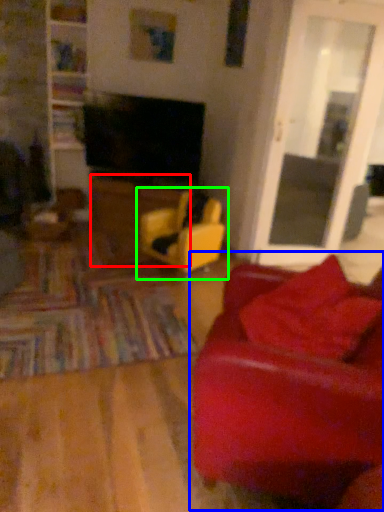
Question: Estimate the real-world distances between objects in this image. Which object is closer to table (highlighted by a red box), studio couch (highlighted by a blue box) or chair (highlighted by a green box)?

Choices:
 (A) studio couch
 (B) chair

Answer: (B)